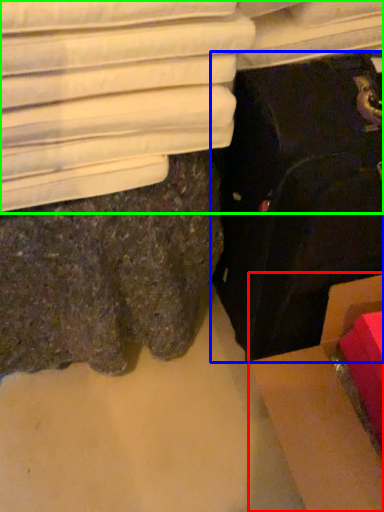
Question: Which is farther away from cardboard box (highlighted by a red box)? suitcase (highlighted by a blue box) or furniture (highlighted by a green box)?

Choices:
 (A) suitcase
 (B) furniture

Answer: (B)